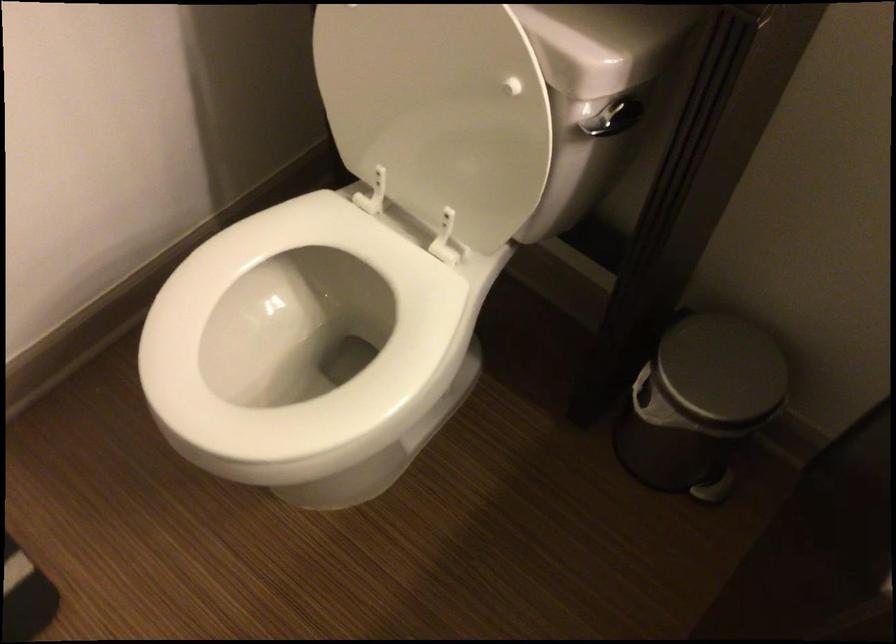
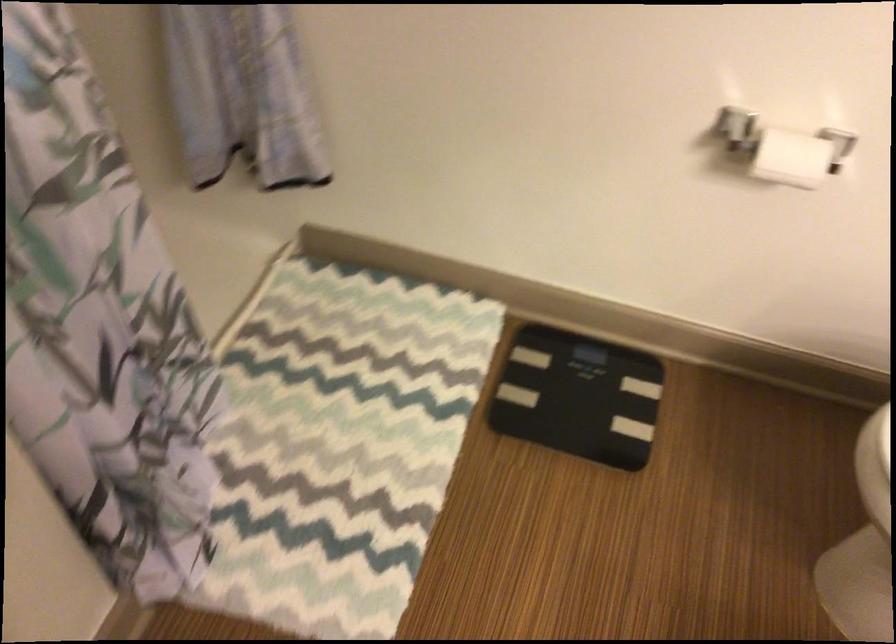
Question: The first image is from the beginning of the video and the second image is from the end. How did the camera likely rotate when shooting the video?

Choices:
 (A) Left
 (B) Right
 (C) Up
 (D) Down

Answer: (A)